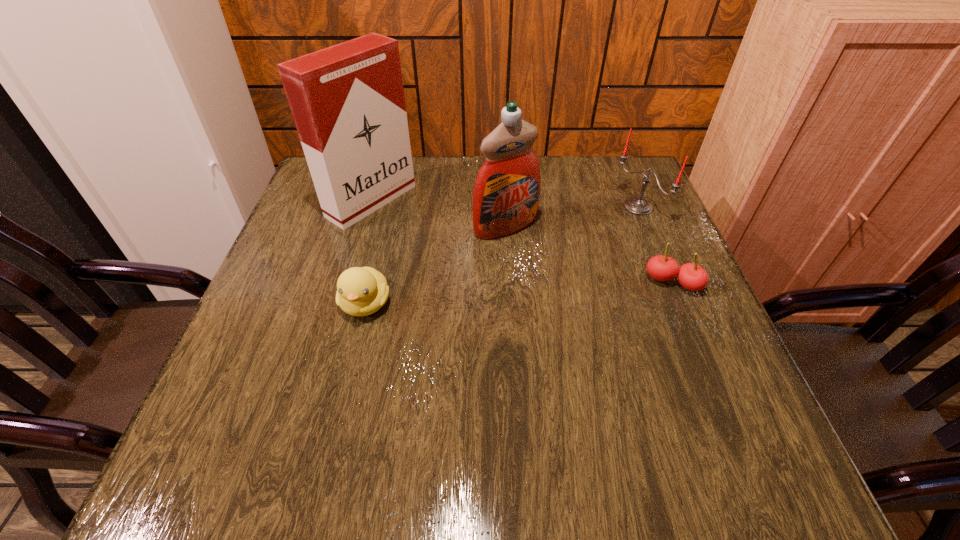
Identify the location of free space located 0.210m on the front surface of the fourth shortest object. The image size is (960, 540). (579, 298).

This screenshot has height=540, width=960. I want to click on vacant point located 0.380m on the front surface of the fourth shortest object, so point(637,358).

At what (x,y) coordinates should I click in order to perform the action: click on free space located 0.090m on the front surface of the fourth shortest object. Please return your answer as a coordinate pair (x, y). This screenshot has height=540, width=960. Looking at the image, I should click on (545, 262).

You are a GUI agent. You are given a task and a screenshot of the screen. Output one action in this format:
    pyautogui.click(x=<x>, y=<y>)
    Task: Click on the vacant space located 0.120m on the front-facing side of the candle
    
    Given the screenshot: What is the action you would take?
    pyautogui.click(x=591, y=237)

Find the location of a particular element. The image size is (960, 540). vacant space located on the front-facing side of the candle is located at coordinates (517, 280).

This screenshot has width=960, height=540. I want to click on blank space located 0.380m on the front-facing side of the candle, so click(507, 286).

You are a GUI agent. You are given a task and a screenshot of the screen. Output one action in this format:
    pyautogui.click(x=<x>, y=<y>)
    Task: Click on the cigarette_case that is positioned at the far edge
    This screenshot has width=960, height=540.
    Given the screenshot: What is the action you would take?
    pyautogui.click(x=347, y=100)

Where is `candle at the far edge`? This screenshot has height=540, width=960. candle at the far edge is located at coordinates (636, 205).

Where is `object that is at the left edge`? This screenshot has height=540, width=960. object that is at the left edge is located at coordinates (347, 100).

Identify the location of cherry located in the right edge section of the desktop. (x=693, y=277).